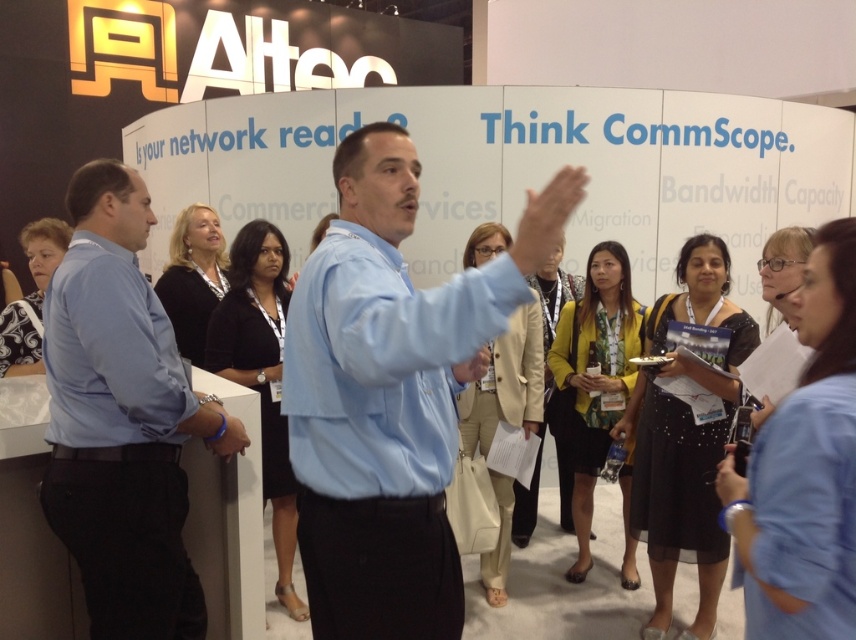
You are at the trade show booth and need to hand out a promotional item to both the person in the light blue shirt at center and the blue shirt at left. Which person should you approach first to ensure you can reach them without walking around the booth display?

You should approach the light blue shirt at center first because they are closer to you, so you don

You are standing at the exhibition booth and want to take a photo of the point at coordinates (431, 566). The camera you are using has a minimum focus distance of 1.5 meters. Will the camera be able to focus on the point?

The point at coordinates (431, 566) is 1.67 meters away from the camera. Since the minimum focus distance is 1.5 meters, the camera can focus on the point because it is beyond the minimum required distance.

You are a photographer at the event and need to ensure all attendees in the photo are clearly visible. The light blue shirt at center and blue shirt at left are both in focus. Which attendee should you adjust the camera settings for to ensure their face is in focus, considering their size in the frame?

The light blue shirt at center is larger in size than the blue shirt at left, so you should adjust the camera settings for the light blue shirt at center to ensure their face is in focus since they are closer to the camera and occupy a larger portion of the frame.